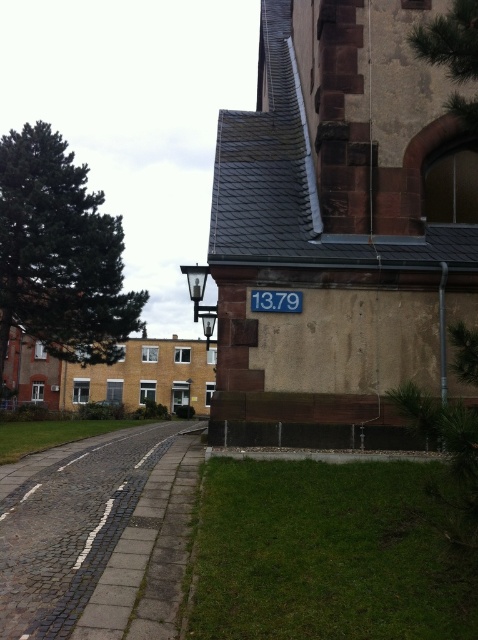
You are standing at the center of the image and want to walk to the cobblestone road at lower left. According to the coordinates provided, in which direction should you move relative to your current position?

The cobblestone road at lower left is located at point coordinates, so you should move towards the lower left direction from your current position to reach it.

You are a delivery driver who needs to park your car on the cobblestone road at lower left. The parking space there can only accommodate vehicles up to the size of the blue painted metal sign at center. Will your car fit?

The cobblestone road at lower left is bigger than the blue painted metal sign at center, so the parking space may be too small for your car since the road itself is larger than the sign, but the sign indicates the maximum size allowed.

You are standing at the point labeled as point (x=72, y=529) in the image. Which direction should you walk to reach the cobblestone road at lower left?

The point (x=72, y=529) corresponds to the cobblestone road at lower left, so you are already standing on it.